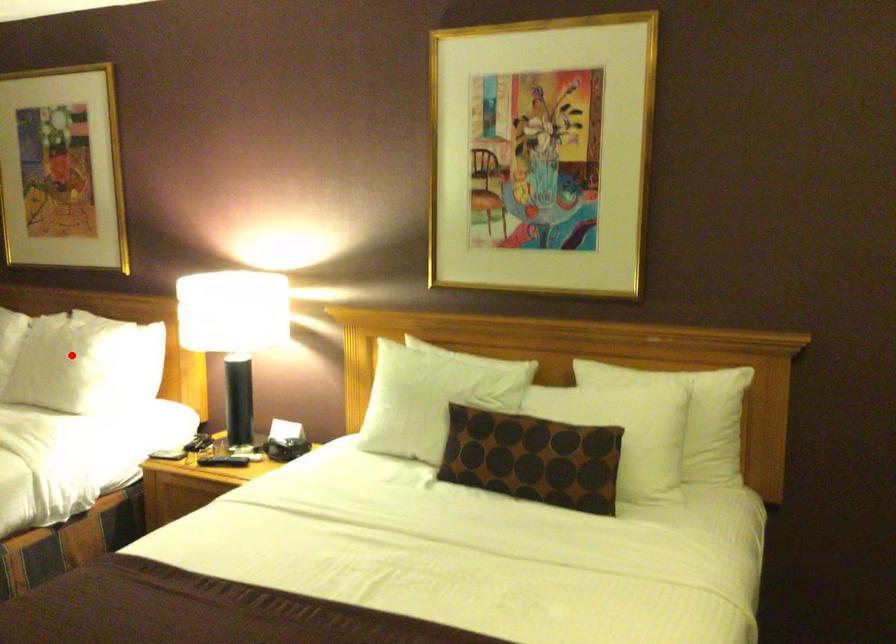
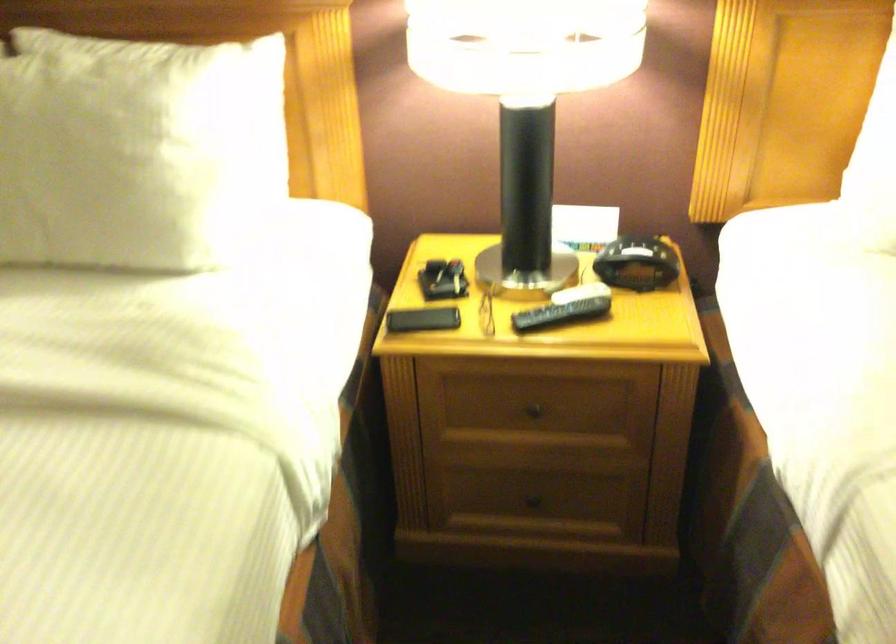
Question: A red point is marked in image1. In image2, is the corresponding 3D point closer to the camera or farther? Reply with the corresponding letter.

Choices:
 (A) The corresponding 3D point is closer.
 (B) The corresponding 3D point is farther.

Answer: (A)